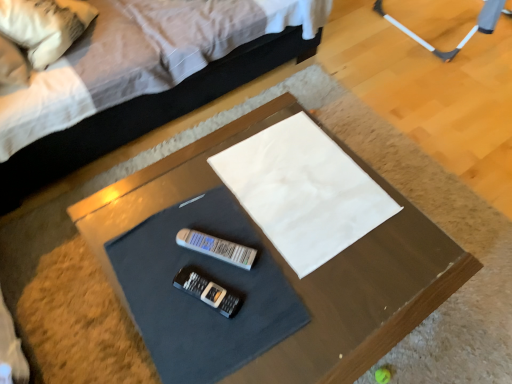
Where is `vacant area that is in front of white fabric at center`? This screenshot has height=384, width=512. vacant area that is in front of white fabric at center is located at coordinates (297, 305).